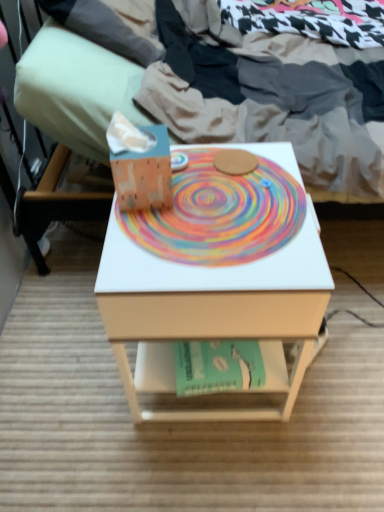
Identify the location of free space to the left of white matte desk at center. (64, 367).